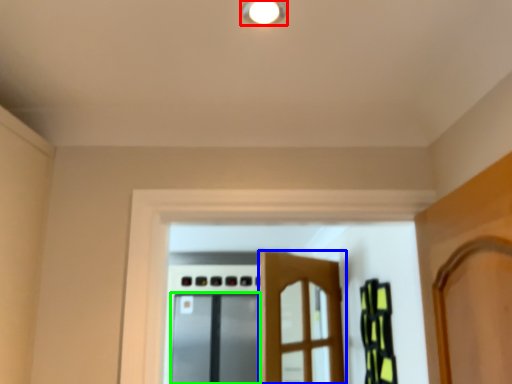
Question: Which is nearer to the light fixture (highlighted by a red box)? door (highlighted by a blue box) or screen door (highlighted by a green box).

Choices:
 (A) door
 (B) screen door

Answer: (A)